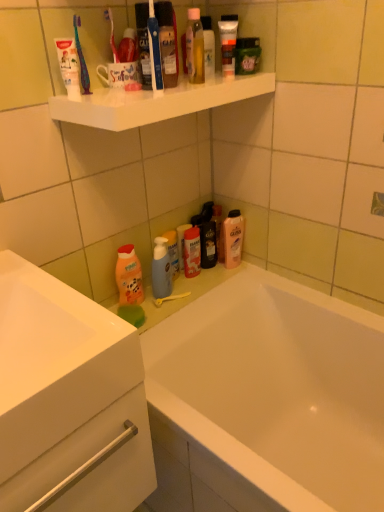
Question: Should I look upward or downward to see white glossy cabinet at lower left?

Choices:
 (A) down
 (B) up

Answer: (A)

Question: Is white matte toothpaste at upper left inside matte plastic tube at upper center, marked as the 2th toiletry in a right-to-left arrangement?

Choices:
 (A) yes
 (B) no

Answer: (B)

Question: Is matte plastic tube at upper center, which is the third toiletry from bottom to top, not inside white matte toothpaste at upper left?

Choices:
 (A) yes
 (B) no

Answer: (A)

Question: Is matte plastic tube at upper center, which is the third toiletry from bottom to top, further to the viewer compared to white matte toothpaste at upper left?

Choices:
 (A) no
 (B) yes

Answer: (B)

Question: Considering the relative sizes of matte plastic tube at upper center, marked as the 2th toiletry in a right-to-left arrangement, and white matte toothpaste at upper left in the image provided, is matte plastic tube at upper center, marked as the 2th toiletry in a right-to-left arrangement, shorter than white matte toothpaste at upper left?

Choices:
 (A) no
 (B) yes

Answer: (A)

Question: Can you confirm if matte plastic tube at upper center, which is the third toiletry from bottom to top, is smaller than white matte toothpaste at upper left?

Choices:
 (A) yes
 (B) no

Answer: (B)

Question: Is matte plastic tube at upper center, marked as the 2th toiletry in a top-to-bottom arrangement, wider than white matte toothpaste at upper left?

Choices:
 (A) yes
 (B) no

Answer: (B)

Question: Is white matte toothpaste at upper left further to camera compared to translucent plastic bottle at lower center, arranged as the 3th toiletry when viewed from the top?

Choices:
 (A) yes
 (B) no

Answer: (B)

Question: From the image's perspective, is white matte toothpaste at upper left on top of translucent plastic bottle at lower center, placed as the second toiletry when sorted from bottom to top?

Choices:
 (A) no
 (B) yes

Answer: (B)

Question: Can you confirm if white matte toothpaste at upper left is taller than translucent plastic bottle at lower center, placed as the second toiletry when sorted from bottom to top?

Choices:
 (A) no
 (B) yes

Answer: (A)

Question: Does white matte toothpaste at upper left have a lesser width compared to translucent plastic bottle at lower center, which is the 1th toiletry from back to front?

Choices:
 (A) yes
 (B) no

Answer: (B)

Question: Is white matte toothpaste at upper left positioned before translucent plastic bottle at lower center, which is the 1th toiletry from back to front?

Choices:
 (A) no
 (B) yes

Answer: (B)

Question: Is white matte toothpaste at upper left bigger than translucent plastic bottle at lower center, arranged as the 3th toiletry when viewed from the top?

Choices:
 (A) yes
 (B) no

Answer: (B)

Question: Does translucent plastic pump bottle at lower center, the 1th toiletry viewed from the left, touch orange matte bottle at lower left?

Choices:
 (A) no
 (B) yes

Answer: (A)